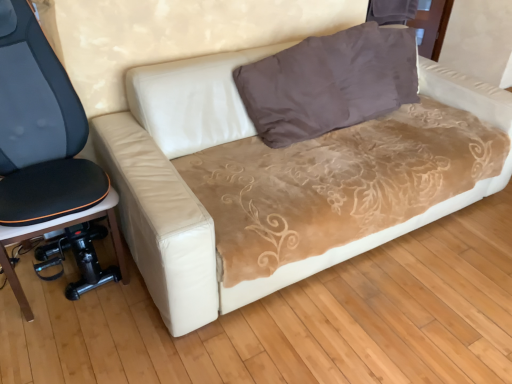
Question: From the image's perspective, does brown velvety pillow at upper center appear lower than black fabric office chair at left?

Choices:
 (A) yes
 (B) no

Answer: (B)

Question: Is brown velvety pillow at upper center far away from black fabric office chair at left?

Choices:
 (A) yes
 (B) no

Answer: (A)

Question: Is brown velvety pillow at upper center to the left of black fabric office chair at left from the viewer's perspective?

Choices:
 (A) no
 (B) yes

Answer: (A)

Question: Is brown velvety pillow at upper center to the right of black fabric office chair at left from the viewer's perspective?

Choices:
 (A) yes
 (B) no

Answer: (A)

Question: Is black fabric office chair at left completely or partially inside brown velvety pillow at upper center?

Choices:
 (A) no
 (B) yes

Answer: (A)

Question: Does brown velvety pillow at upper center have a lesser width compared to black fabric office chair at left?

Choices:
 (A) yes
 (B) no

Answer: (A)

Question: Is the position of black fabric office chair at left less distant than that of brown velvety pillow at upper center?

Choices:
 (A) no
 (B) yes

Answer: (B)

Question: Is black fabric office chair at left turned away from brown velvety pillow at upper center?

Choices:
 (A) no
 (B) yes

Answer: (A)

Question: Can you confirm if black fabric office chair at left is positioned to the left of brown velvety pillow at upper center?

Choices:
 (A) no
 (B) yes

Answer: (B)

Question: Can you confirm if black fabric office chair at left is thinner than brown velvety pillow at upper center?

Choices:
 (A) no
 (B) yes

Answer: (A)

Question: Is black fabric office chair at left bigger than brown velvety pillow at upper center?

Choices:
 (A) no
 (B) yes

Answer: (B)

Question: Does black fabric office chair at left have a smaller size compared to brown velvety pillow at upper center?

Choices:
 (A) no
 (B) yes

Answer: (A)

Question: Does black fabric office chair at left appear on the left side of beige suede couch at center?

Choices:
 (A) yes
 (B) no

Answer: (A)